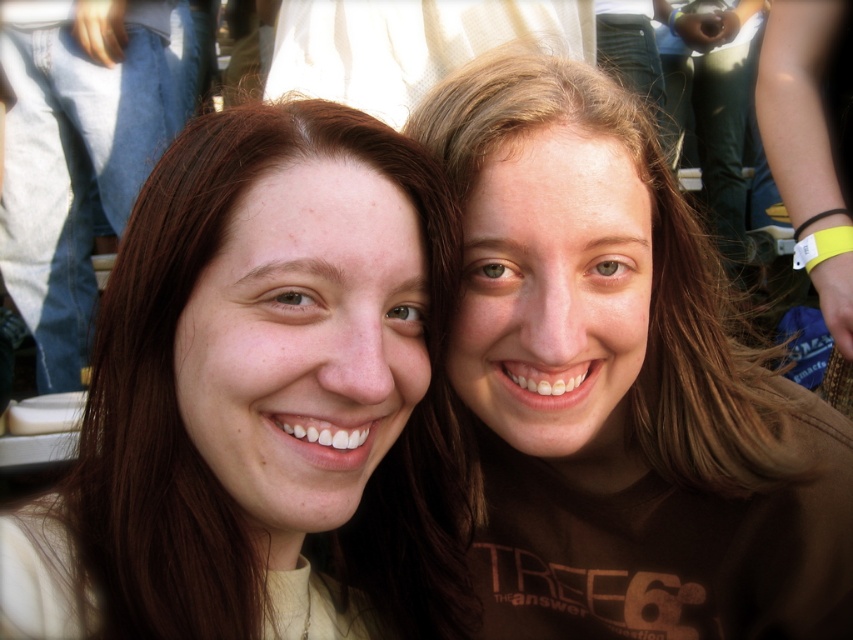
You are a photographer adjusting the lighting for a group photo. You notice two strands of hair in the frame from the person on the left. The strands are labeled as matte beige hair at left and matte brown hair at left. Which strand is closer to the bottom of the frame?

The matte beige hair at left is located below the matte brown hair at left, so it is closer to the bottom of the frame.

You are a photographer trying to adjust the lighting for a photo. You notice a point at coordinates (619,385). Based on the scene description, what object or feature is located at this point?

The point at coordinates (619,385) corresponds to the brown matte hair at upper right.

You are taking a photo of two friends at an event. The camera you are using has a minimum focus distance of 30 inches. There is a point at coordinates point (x=86, y=508) that you need to ensure is in focus. Based on the description, will this point be in focus?

The point at coordinates point (x=86, y=508) is 29.00 inches from the camera, which is less than the minimum focus distance of 30 inches. Therefore, the point will not be in focus.